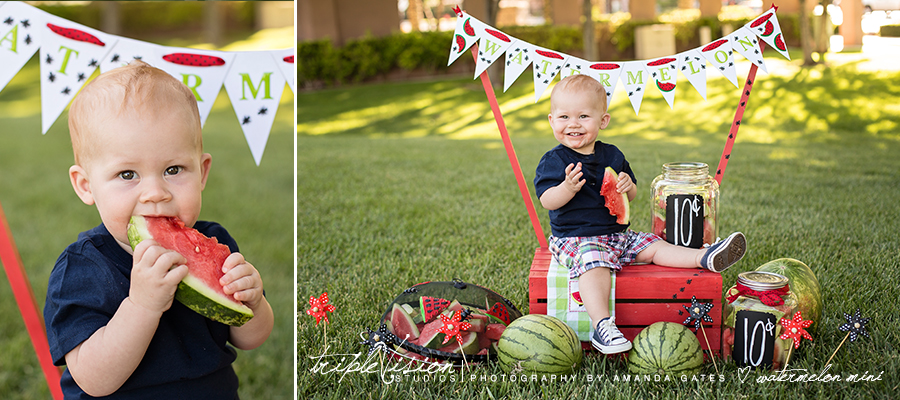
You are a GUI agent. You are given a task and a screenshot of the screen. Output one action in this format:
    pyautogui.click(x=<x>, y=<y>)
    Task: Click on the party banner
    The image size is (900, 400).
    Given the screenshot: What is the action you would take?
    pyautogui.click(x=667, y=69)